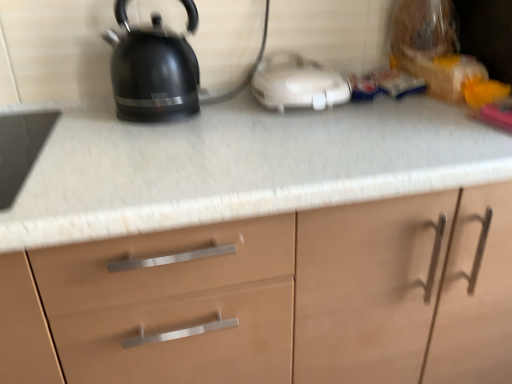
You are a GUI agent. You are given a task and a screenshot of the screen. Output one action in this format:
    pyautogui.click(x=<x>, y=<y>)
    Task: Click on the vacant space to the right of black glossy kettle at upper left
    The image size is (512, 384).
    Given the screenshot: What is the action you would take?
    pyautogui.click(x=234, y=126)